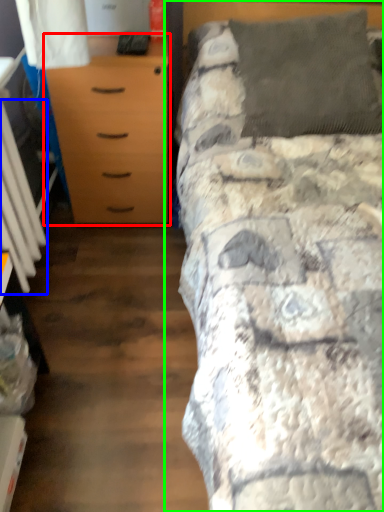
Question: Which object is the closest to the chest of drawers (highlighted by a red box)? Choose among these: radiator (highlighted by a blue box) or bed (highlighted by a green box).

Choices:
 (A) radiator
 (B) bed

Answer: (A)